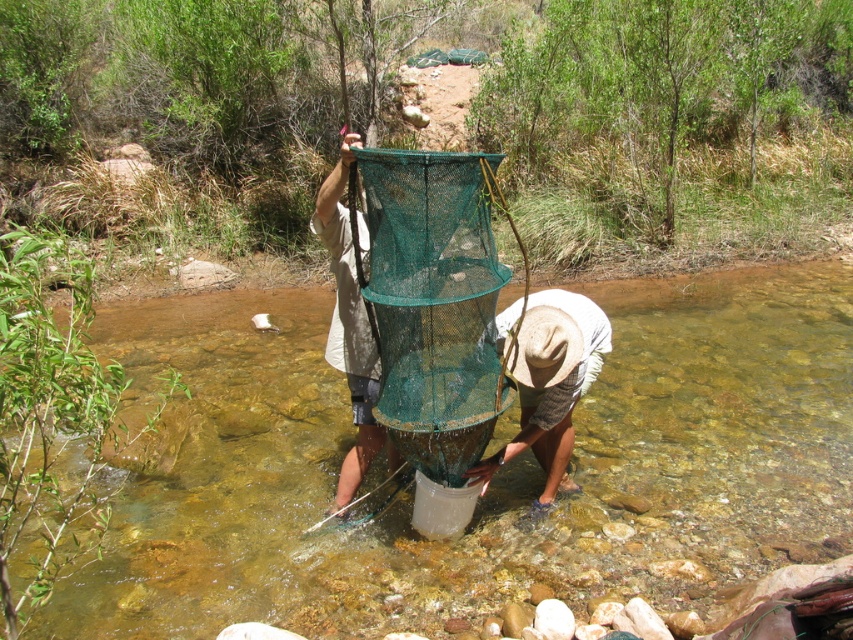
Can you confirm if clear water at center is taller than green mesh net at center?

No, clear water at center is not taller than green mesh net at center.

Which is behind, point (199, 572) or point (329, 204)?

Positioned behind is point (199, 572).

Locate an element on the screen. clear water at center is located at coordinates pos(492,477).

Who is shorter, light brown straw hat at lower center or green mesh net at center?

Standing shorter between the two is light brown straw hat at lower center.

Which is below, light brown straw hat at lower center or green mesh net at center?

Positioned lower is light brown straw hat at lower center.

Measure the distance between light brown straw hat at lower center and camera.

light brown straw hat at lower center and camera are 3.39 meters apart.

In order to click on light brown straw hat at lower center in this screenshot , I will do `click(549, 380)`.

Is clear water at center smaller than light brown straw hat at lower center?

Correct, clear water at center occupies less space than light brown straw hat at lower center.

Who is more distant from viewer, [664,483] or [537,348]?

Positioned behind is point [664,483].

The height and width of the screenshot is (640, 853). Find the location of `clear water at center`. clear water at center is located at coordinates click(x=492, y=477).